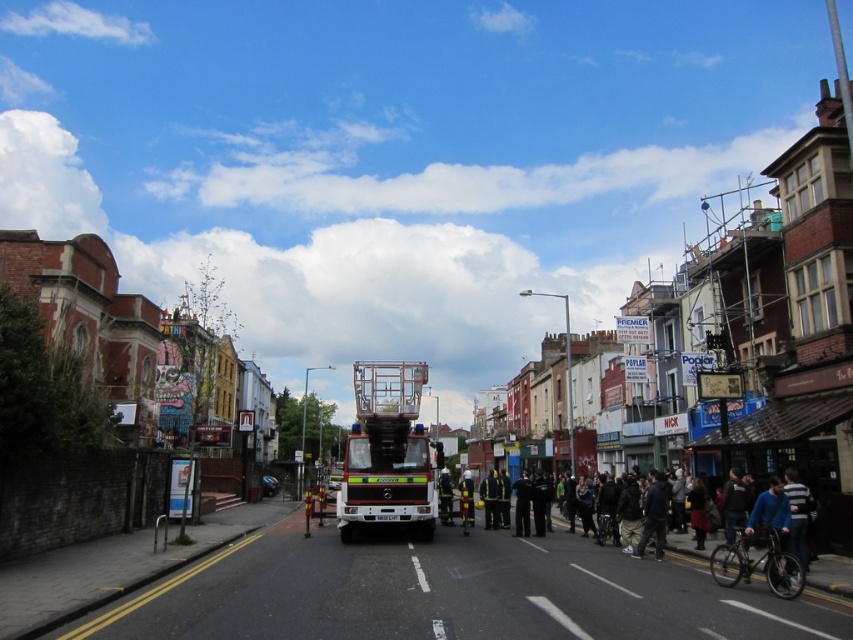
You are a pedestrian standing on the sidewalk across the street from the metallic silver fire truck at center and the reflective yellow jacket at center. You want to cross the street to take a closer look at both objects. Considering their sizes, which object will appear bigger to you as you approach them?

The metallic silver fire truck at center will appear bigger because it has a larger size compared to the reflective yellow jacket at center.

You are a pedestrian standing on the sidewalk and see both the reflective yellow uniform at center and the reflective yellow jacket at center. Which one is closer to you?

The reflective yellow uniform at center is closer to you because it is further to the viewer than the reflective yellow jacket at center.